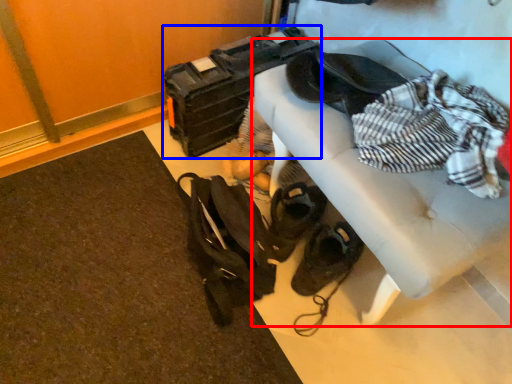
Question: Which point is further to the camera, furniture (highlighted by a red box) or luggage (highlighted by a blue box)?

Choices:
 (A) furniture
 (B) luggage

Answer: (B)